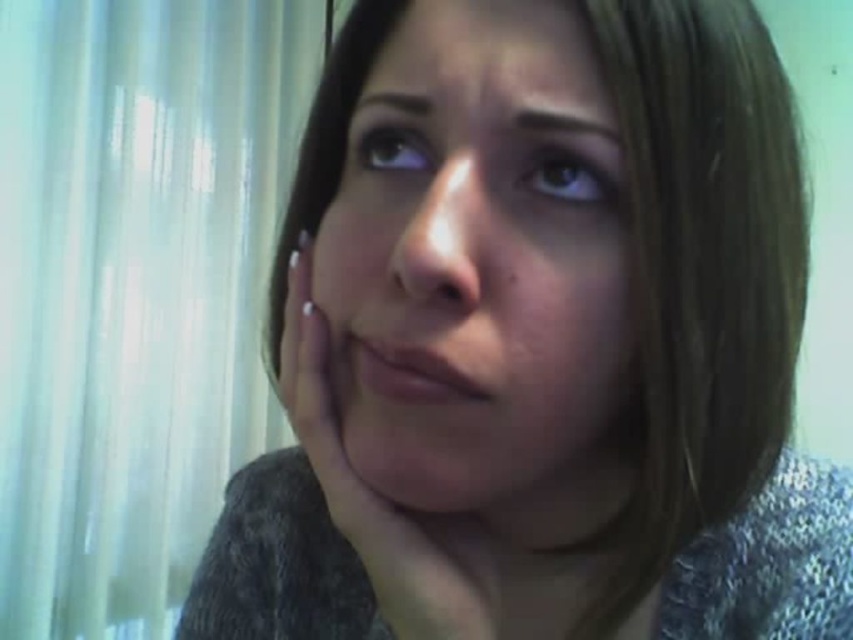
Question: Does smooth skin face at center have a smaller size compared to nail polish at center?

Choices:
 (A) no
 (B) yes

Answer: (A)

Question: Which of the following is the farthest from the observer?

Choices:
 (A) white sheer curtain at left
 (B) nail polish at center
 (C) smooth skin face at center

Answer: (A)

Question: Does white sheer curtain at left lie behind smooth skin face at center?

Choices:
 (A) no
 (B) yes

Answer: (B)

Question: Which object appears farthest from the camera in this image?

Choices:
 (A) smooth skin face at center
 (B) white sheer curtain at left
 (C) nail polish at center

Answer: (B)

Question: Does white sheer curtain at left have a larger size compared to nail polish at center?

Choices:
 (A) yes
 (B) no

Answer: (A)

Question: Which object is the farthest from the smooth skin face at center?

Choices:
 (A) nail polish at center
 (B) white sheer curtain at left

Answer: (B)